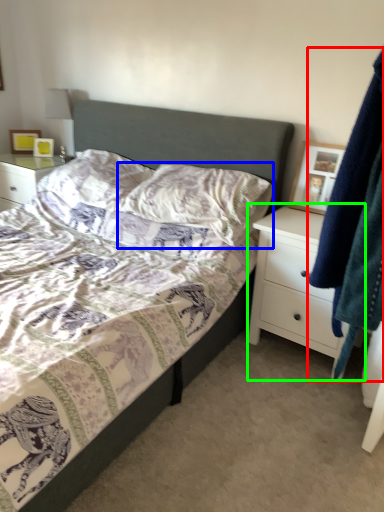
Question: Which object is positioned farthest from clothing (highlighted by a red box)? Select from pillow (highlighted by a blue box) and chest of drawers (highlighted by a green box).

Choices:
 (A) pillow
 (B) chest of drawers

Answer: (A)